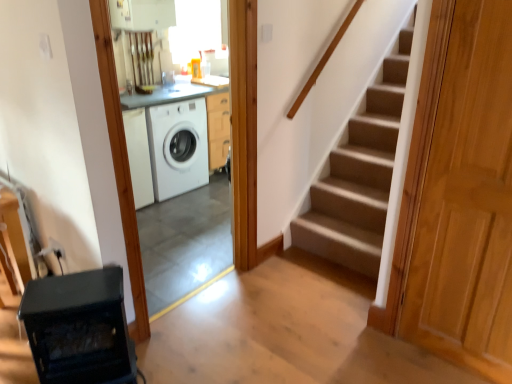
Question: Considering the relative sizes of white glossy washing machine at center and light brown wooden door at right in the image provided, is white glossy washing machine at center smaller than light brown wooden door at right?

Choices:
 (A) no
 (B) yes

Answer: (A)

Question: Are white glossy washing machine at center and light brown wooden door at right far apart?

Choices:
 (A) yes
 (B) no

Answer: (A)

Question: From a real-world perspective, is white glossy washing machine at center under light brown wooden door at right?

Choices:
 (A) no
 (B) yes

Answer: (B)

Question: Considering the relative sizes of white glossy washing machine at center and light brown wooden door at right in the image provided, is white glossy washing machine at center wider than light brown wooden door at right?

Choices:
 (A) yes
 (B) no

Answer: (A)

Question: From the image's perspective, does white glossy washing machine at center appear lower than light brown wooden door at right?

Choices:
 (A) yes
 (B) no

Answer: (B)

Question: Can you confirm if white glossy washing machine at center is thinner than light brown wooden door at right?

Choices:
 (A) no
 (B) yes

Answer: (A)

Question: Are white glossy washing machine at center and light brown wooden door at right far apart?

Choices:
 (A) yes
 (B) no

Answer: (A)

Question: Is white glossy washing machine at center to the left of light brown wooden door at right from the viewer's perspective?

Choices:
 (A) yes
 (B) no

Answer: (A)

Question: From the image's perspective, is white glossy washing machine at center under light brown wooden door at right?

Choices:
 (A) no
 (B) yes

Answer: (A)

Question: From the image's perspective, would you say white glossy washing machine at center is positioned over light brown wooden door at right?

Choices:
 (A) no
 (B) yes

Answer: (B)

Question: Is white glossy washing machine at center smaller than light brown wooden door at right?

Choices:
 (A) yes
 (B) no

Answer: (B)

Question: Is white glossy washing machine at center taller than light brown wooden door at right?

Choices:
 (A) yes
 (B) no

Answer: (A)

Question: Are light brown wooden door at right and white glossy washing machine at center far apart?

Choices:
 (A) yes
 (B) no

Answer: (A)